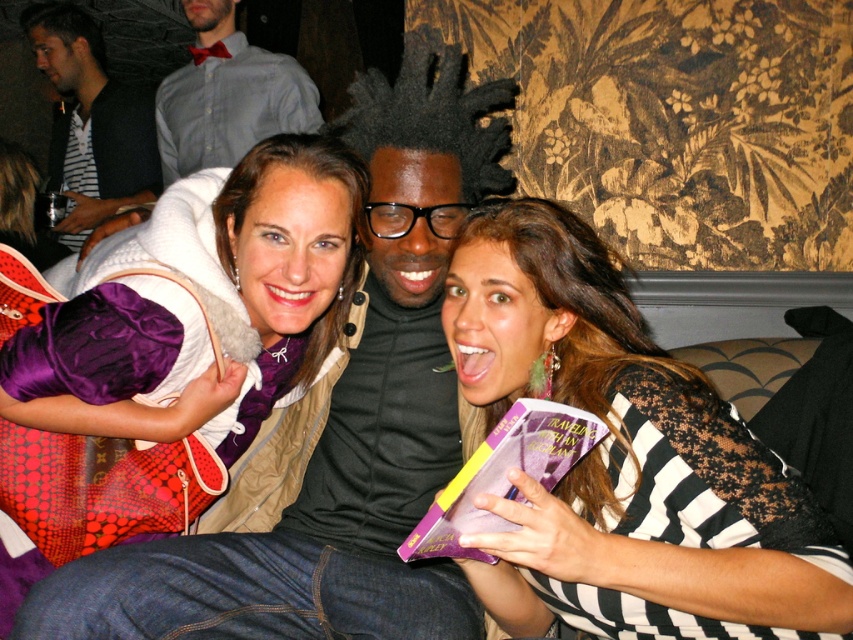
You are a photographer setting up for a group photo. You notice the striped lace dress at center and the matte purple scarf at center. Which one is closer to the camera?

The striped lace dress at center is in front of the matte purple scarf at center, so it is closer to the camera.